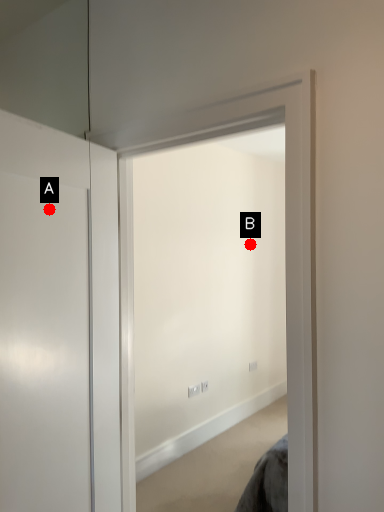
Question: Two points are circled on the image, labeled by A and B beside each circle. Which point is farther to the camera?

Choices:
 (A) A is further
 (B) B is further

Answer: (B)